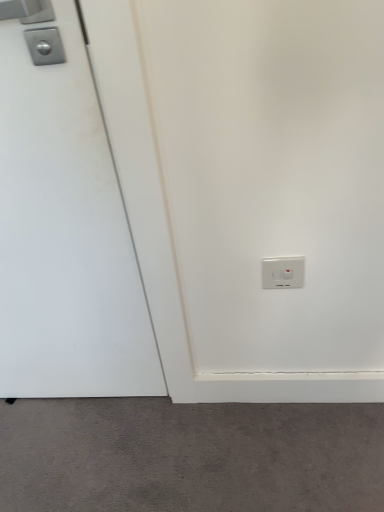
Question: From a real-world perspective, is white matte door at left physically located above or below gray matte carpet at lower center?

Choices:
 (A) below
 (B) above

Answer: (B)

Question: In the image, is white matte door at left on the left side or the right side of gray matte carpet at lower center?

Choices:
 (A) left
 (B) right

Answer: (A)

Question: Which of these objects is positioned farthest from the white matte door at left?

Choices:
 (A) gray matte carpet at lower center
 (B) white plastic power plugs and sockets at lower right

Answer: (B)

Question: Which is farther from the white matte door at left?

Choices:
 (A) white plastic power plugs and sockets at lower right
 (B) gray matte carpet at lower center

Answer: (A)